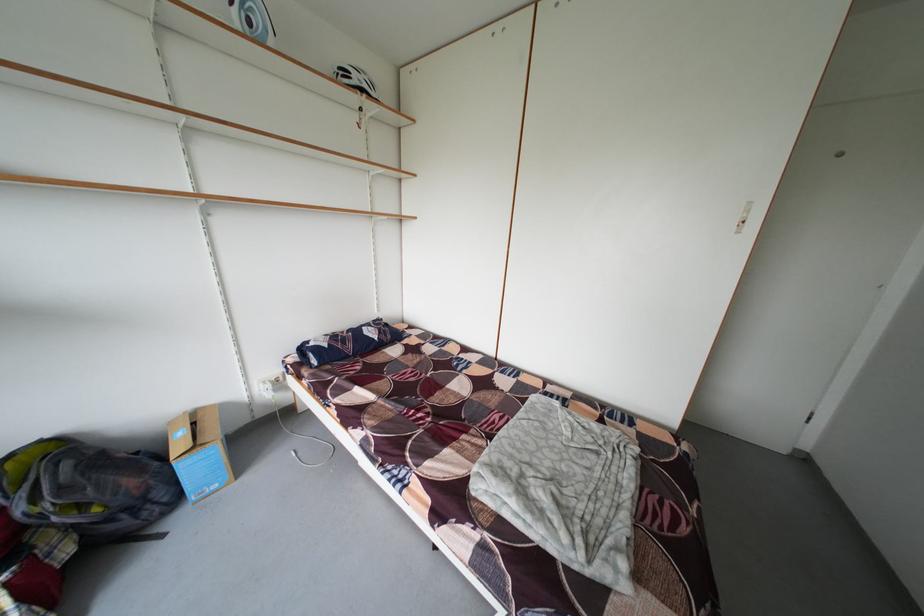
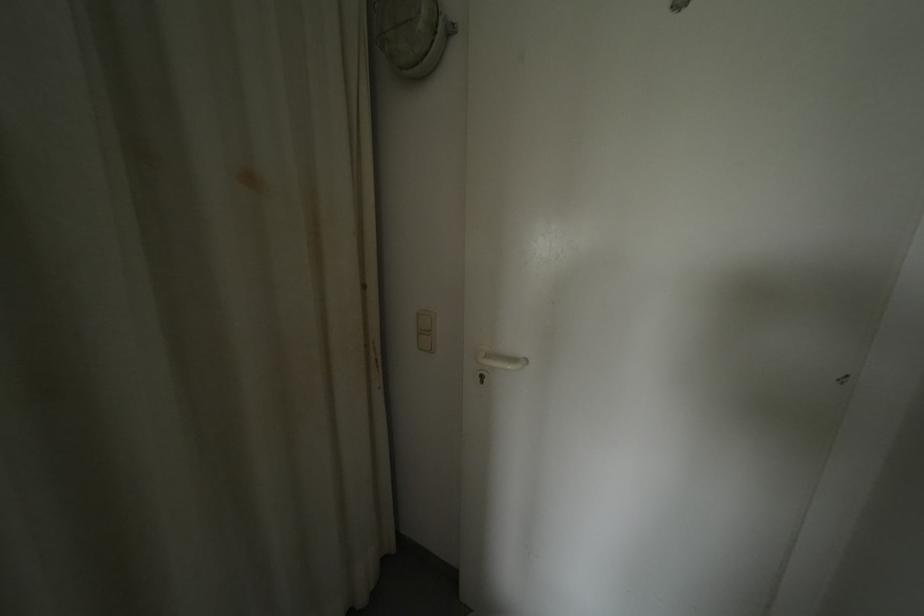
In a continuous first-person perspective shot, in which direction is the camera moving?

The cameraman moved toward right, forward.